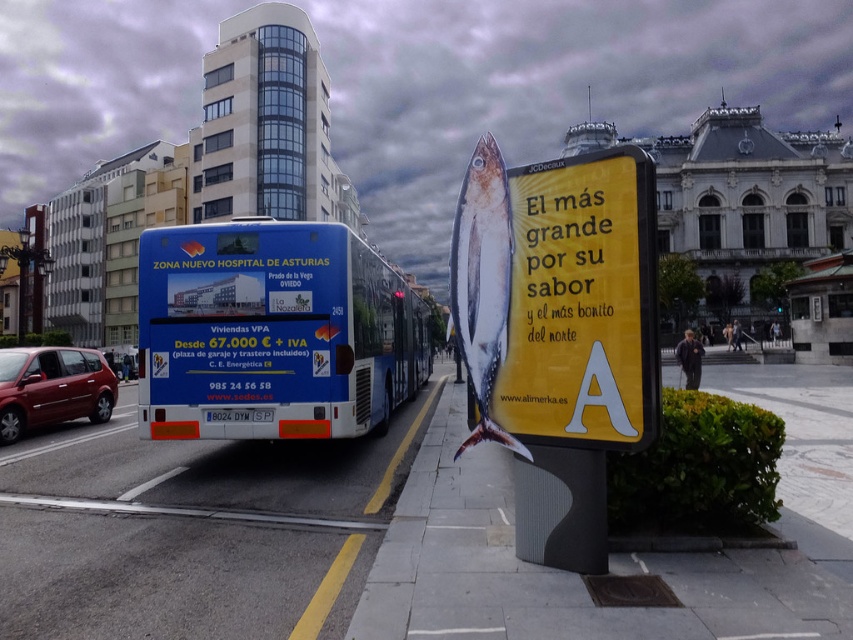
Is blue metallic bus at center wider than shiny red car at left?

Correct, the width of blue metallic bus at center exceeds that of shiny red car at left.

Can you confirm if blue metallic bus at center is shorter than shiny red car at left?

In fact, blue metallic bus at center may be taller than shiny red car at left.

At what (x,y) coordinates should I click in order to perform the action: click on blue metallic bus at center. Please return your answer as a coordinate pair (x, y). Looking at the image, I should click on (271, 332).

Between yellow paperboard sign at center and shiny red car at left, which one appears on the left side from the viewer's perspective?

From the viewer's perspective, shiny red car at left appears more on the left side.

Which is more to the right, yellow paperboard sign at center or shiny red car at left?

Positioned to the right is yellow paperboard sign at center.

Is point (607, 428) farther from camera compared to point (97, 352)?

No.

I want to click on yellow paperboard sign at center, so click(x=558, y=333).

Between yellow paperboard sign at center and blue metallic bus at center, which one has less height?

yellow paperboard sign at center

Does point (527, 484) come closer to viewer compared to point (305, 252)?

Yes, point (527, 484) is closer to viewer.

Find the location of a particular element. This screenshot has width=853, height=640. yellow paperboard sign at center is located at coordinates (558, 333).